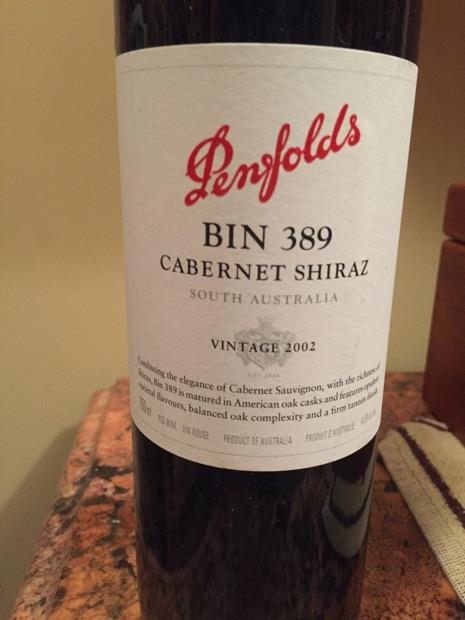
At what (x,y) coordinates should I click in order to perform the action: click on decorative items. Please return your answer as a coordinate pair (x, y). The height and width of the screenshot is (620, 465). Looking at the image, I should click on (443, 441), (457, 397).